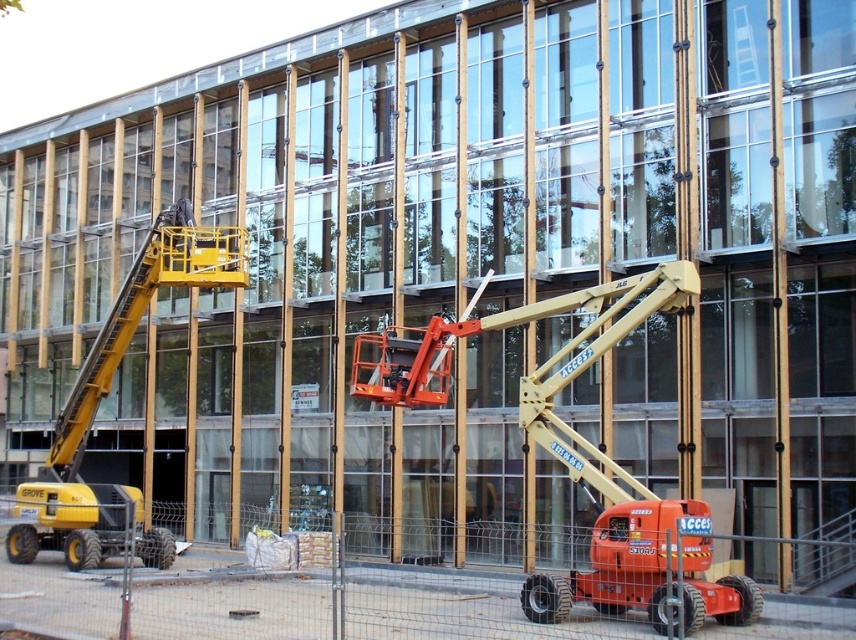
Does yellow rubber construction vehicle at lower left have a lesser height compared to yellow metallic cherry picker at left?

Correct, yellow rubber construction vehicle at lower left is not as tall as yellow metallic cherry picker at left.

Does yellow rubber construction vehicle at lower left have a lesser width compared to yellow metallic cherry picker at left?

No.

This screenshot has height=640, width=856. What are the coordinates of `yellow rubber construction vehicle at lower left` in the screenshot? It's located at (263, 589).

Is point (611, 344) more distant than point (201, 234)?

No, it is not.

Is orange metallic lift at center positioned behind yellow metallic cherry picker at left?

No, orange metallic lift at center is in front of yellow metallic cherry picker at left.

Is point (670, 291) more distant than point (4, 547)?

No, it is not.

Where is `orange metallic lift at center`? orange metallic lift at center is located at coordinates (556, 429).

Can you confirm if yellow rubber construction vehicle at lower left is positioned to the right of orange metallic lift at center?

In fact, yellow rubber construction vehicle at lower left is to the left of orange metallic lift at center.

From the picture: Does yellow rubber construction vehicle at lower left have a smaller size compared to orange metallic lift at center?

No, yellow rubber construction vehicle at lower left is not smaller than orange metallic lift at center.

Is point (638, 618) closer to camera compared to point (569, 372)?

Yes, point (638, 618) is in front of point (569, 372).

In order to click on yellow rubber construction vehicle at lower left in this screenshot , I will do `click(263, 589)`.